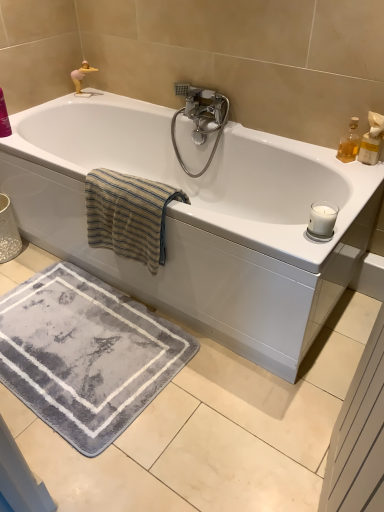
Question: Would you say white glossy bathtub at center is to the left or to the right of beige striped towel at upper left in the picture?

Choices:
 (A) left
 (B) right

Answer: (B)

Question: In terms of width, does white glossy bathtub at center look wider or thinner when compared to beige striped towel at upper left?

Choices:
 (A) wide
 (B) thin

Answer: (A)

Question: Which object is positioned closest to the polished chrome faucet at upper center?

Choices:
 (A) white glossy bathtub at center
 (B) translucent glass bottle at upper right
 (C) beige striped towel at upper left
 (D) translucent amber glass at upper right

Answer: (A)

Question: Based on their relative distances, which object is farther from the beige striped towel at upper left?

Choices:
 (A) white glossy bathtub at center
 (B) translucent amber glass at upper right
 (C) translucent glass bottle at upper right
 (D) polished chrome faucet at upper center

Answer: (C)